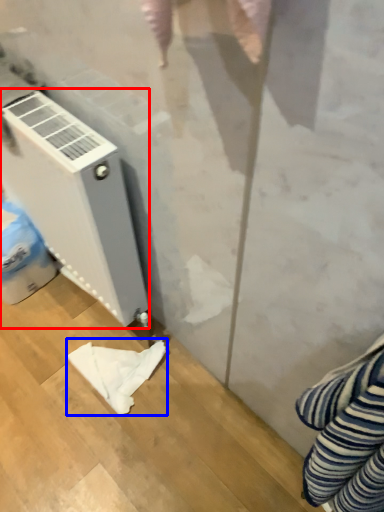
Question: Which object appears closest to the camera in this image, home appliance (highlighted by a red box) or cloth (highlighted by a blue box)?

Choices:
 (A) home appliance
 (B) cloth

Answer: (A)